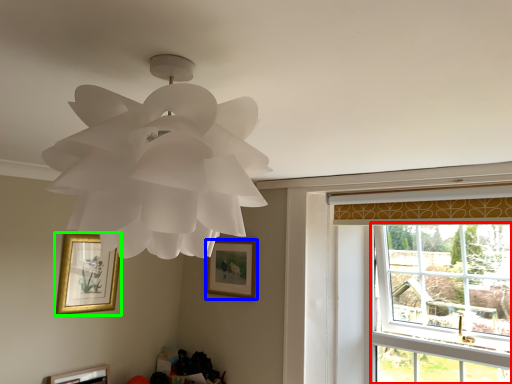
Question: Which object is the farthest from window (highlighted by a red box)? Choose among these: picture frame (highlighted by a blue box) or picture frame (highlighted by a green box).

Choices:
 (A) picture frame
 (B) picture frame

Answer: (B)